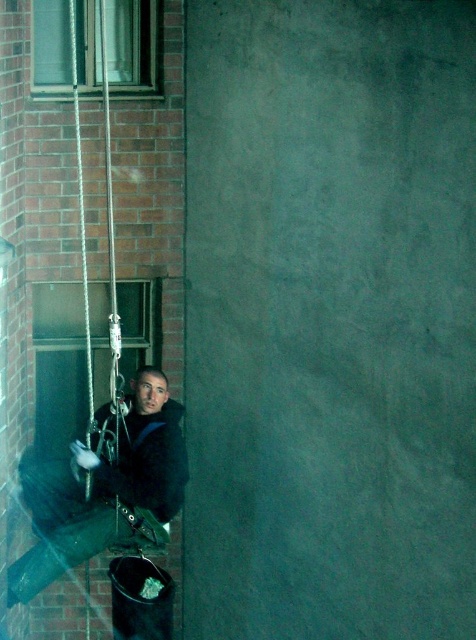
You are standing on the ground looking at the building. There are two points marked on the building wall. The first point is at coordinates point (136, 506) and the second point is at point (53, 68). Which point is closer to you?

Point (136, 506) is in front of point (53, 68), so it is closer to you.